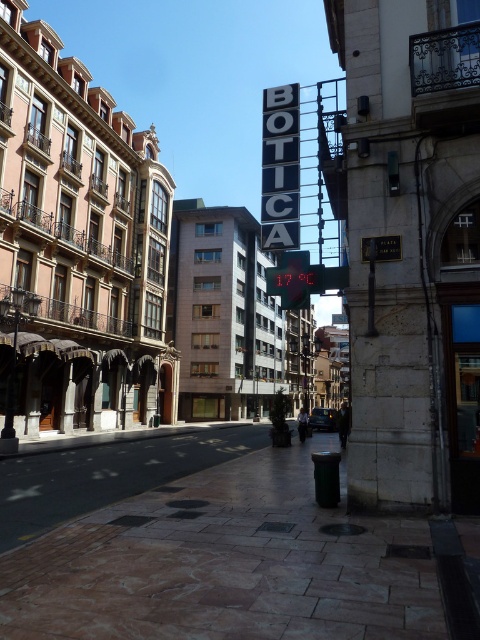
Which is more to the left, brown stone pavement at lower center or black metal sign at upper center?

brown stone pavement at lower center is more to the left.

Can you confirm if brown stone pavement at lower center is taller than black metal sign at upper center?

No, brown stone pavement at lower center is not taller than black metal sign at upper center.

Who is more forward, (420, 538) or (298, 188)?

Positioned in front is point (420, 538).

Where is `brown stone pavement at lower center`? This screenshot has height=640, width=480. brown stone pavement at lower center is located at coordinates (227, 563).